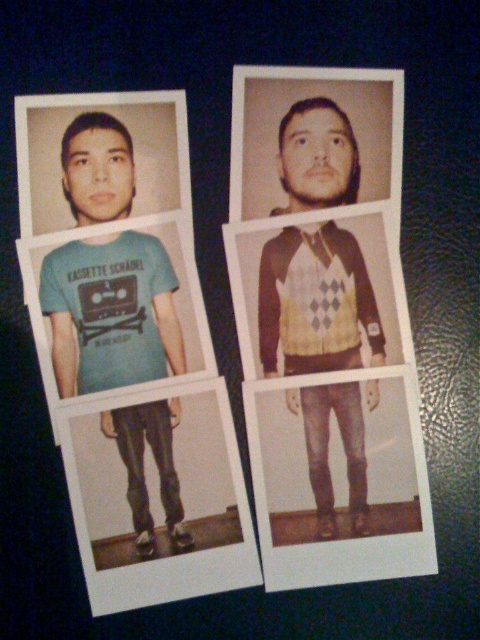
Is matte blue t-shirt at lower left bigger than matte brown hair at center?

Indeed, matte blue t-shirt at lower left has a larger size compared to matte brown hair at center.

Locate an element on the screen. matte blue t-shirt at lower left is located at coordinates (110, 312).

Identify the location of matte blue t-shirt at lower left. This screenshot has height=640, width=480. (110, 312).